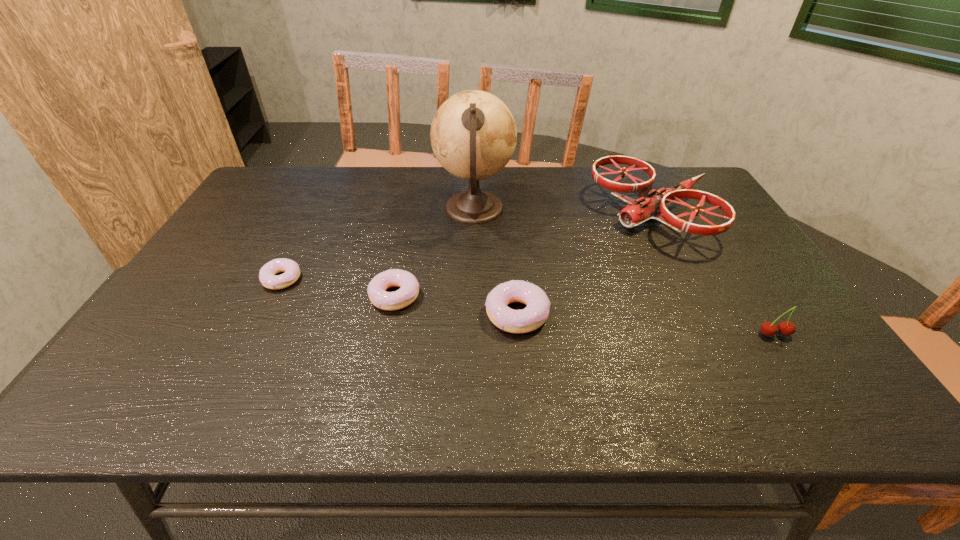
At what (x,y) coordinates should I click in order to perform the action: click on vacant area that lies between the second doughnut from left to right and the fourth shortest object. Please return your answer as a coordinate pair (x, y). Looking at the image, I should click on (585, 315).

At what (x,y) coordinates should I click in order to perform the action: click on empty location between the second doughnut from right to left and the shortest object. Please return your answer as a coordinate pair (x, y). The height and width of the screenshot is (540, 960). Looking at the image, I should click on (338, 287).

Locate an element on the screen. vacant area that lies between the tallest doughnut and the cherry is located at coordinates 646,324.

Find the location of `vacant area that lies between the second tallest object and the third tallest object`. vacant area that lies between the second tallest object and the third tallest object is located at coordinates (714, 275).

Where is `free space between the second tallest object and the second doughnut from right to left`? This screenshot has height=540, width=960. free space between the second tallest object and the second doughnut from right to left is located at coordinates (524, 256).

This screenshot has width=960, height=540. Find the location of `free area in between the second doughnut from right to left and the cherry`. free area in between the second doughnut from right to left and the cherry is located at coordinates (585, 315).

In order to click on free space between the fourth tallest object and the fifth shortest object in this screenshot , I will do `click(586, 265)`.

You are a GUI agent. You are given a task and a screenshot of the screen. Output one action in this format:
    pyautogui.click(x=<x>, y=<y>)
    Task: Click on the vacant space that is in between the drone and the tallest object
    Image resolution: width=960 pixels, height=540 pixels.
    Given the screenshot: What is the action you would take?
    pyautogui.click(x=564, y=213)

Locate which object ranks in proximity to the fourth tallest object. Please provide its 2D coordinates. Your answer should be formatted as a tuple, i.e. [(x, y)], where the tuple contains the x and y coordinates of a point satisfying the conditions above.

[(409, 290)]

Select which object is the second closest to the shortest doughnut. Please provide its 2D coordinates. Your answer should be formatted as a tuple, i.e. [(x, y)], where the tuple contains the x and y coordinates of a point satisfying the conditions above.

[(473, 134)]